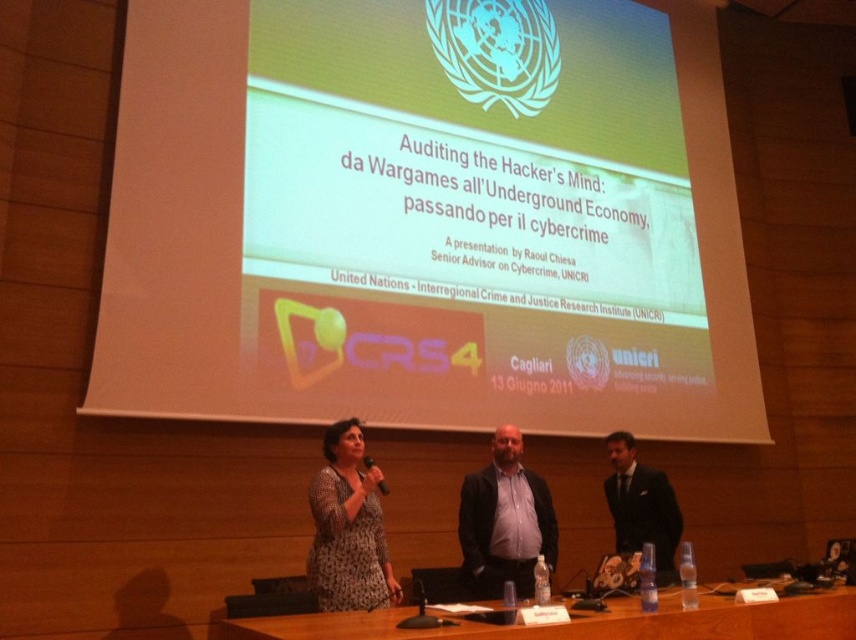
Question: Is the position of printed fabric dress at center less distant than that of dark suit at center?

Choices:
 (A) no
 (B) yes

Answer: (B)

Question: Based on their relative distances, which object is nearer to the wooden table at center?

Choices:
 (A) matte black jacket at center
 (B) printed fabric dress at center
 (C) dark suit at center

Answer: (B)

Question: Does wooden table at center appear on the left side of dark suit at center?

Choices:
 (A) no
 (B) yes

Answer: (B)

Question: Which point is closer to the camera?

Choices:
 (A) (658, 509)
 (B) (816, 612)
 (C) (504, 538)
 (D) (317, 506)

Answer: (B)

Question: In this image, where is wooden table at center located relative to dark suit at center?

Choices:
 (A) right
 (B) left

Answer: (B)

Question: Which point is closer to the camera?

Choices:
 (A) 495,512
 (B) 657,496

Answer: (A)